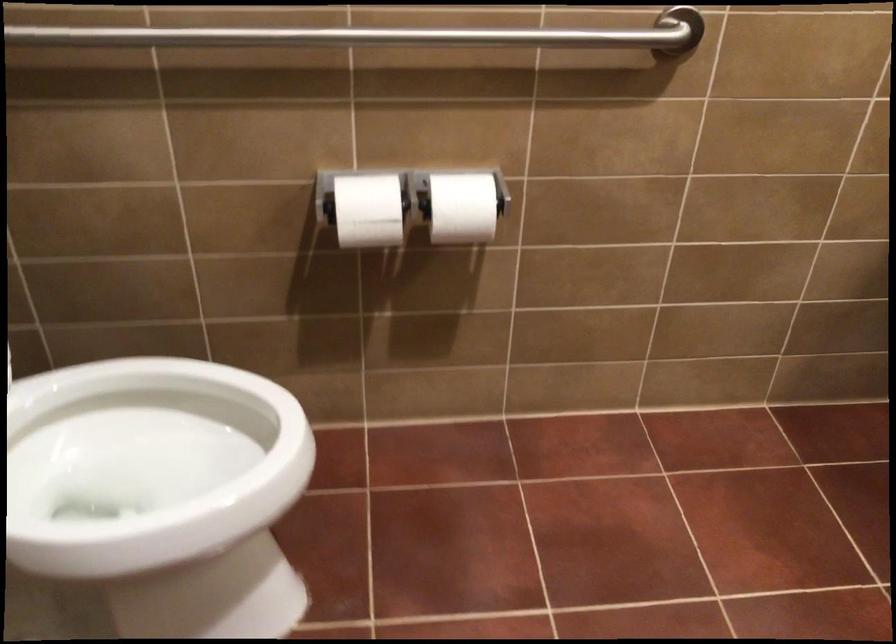
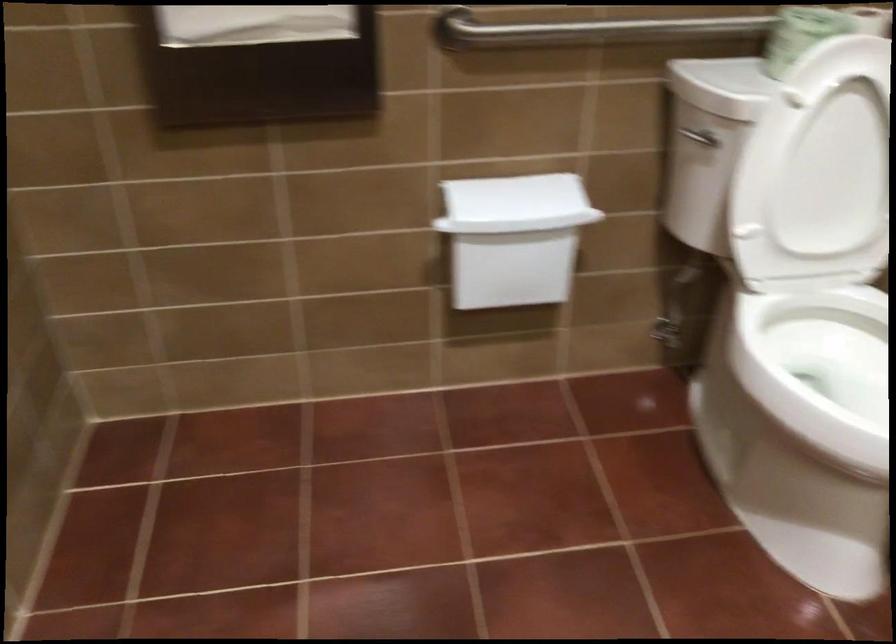
Locate, in the second image, the point that corresponds to [73,496] in the first image.

(819, 368)